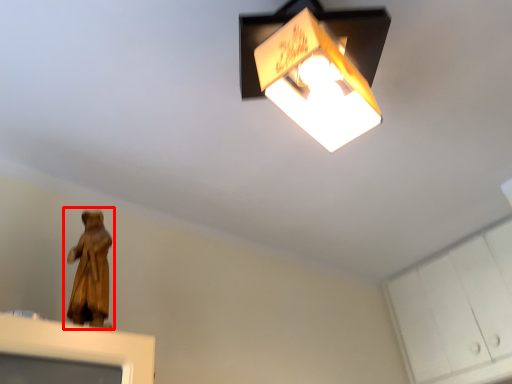
Question: Where is person (annotated by the red box) located in relation to cabinetry in the image?

Choices:
 (A) right
 (B) left

Answer: (B)